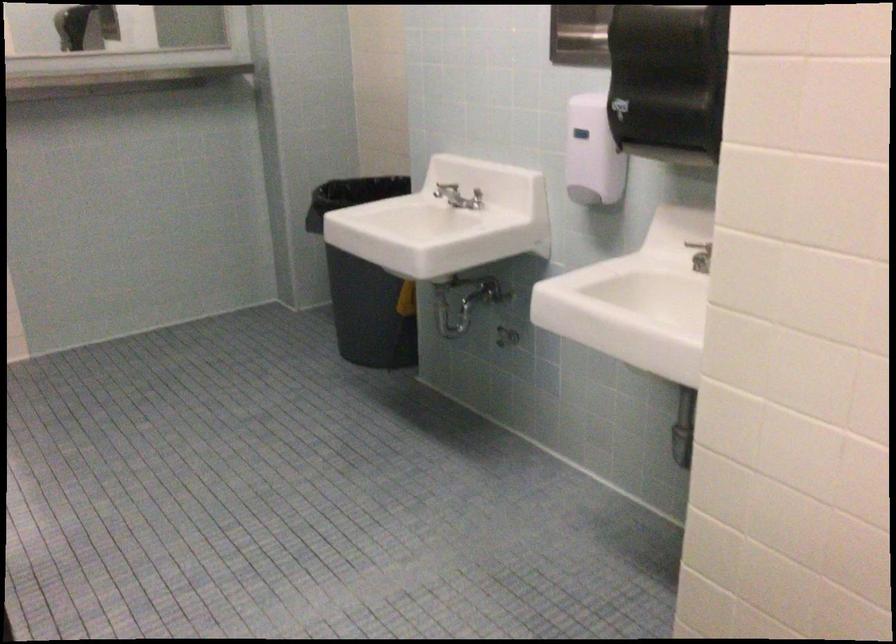
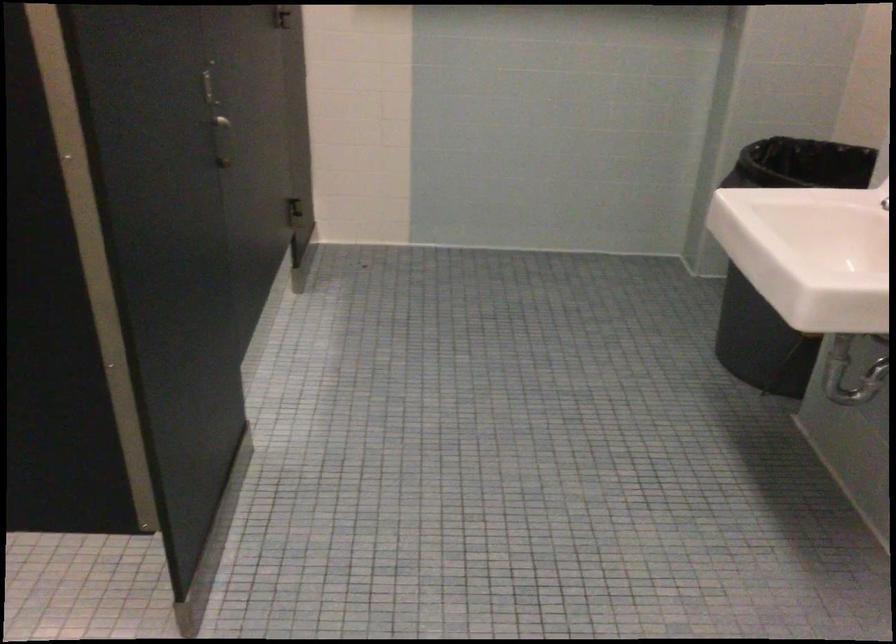
Question: The camera is either moving clockwise (left) or counter-clockwise (right) around the object. The first image is from the beginning of the video and the second image is from the end. Is the camera moving left or right when shooting the video?

Choices:
 (A) Left
 (B) Right

Answer: (B)